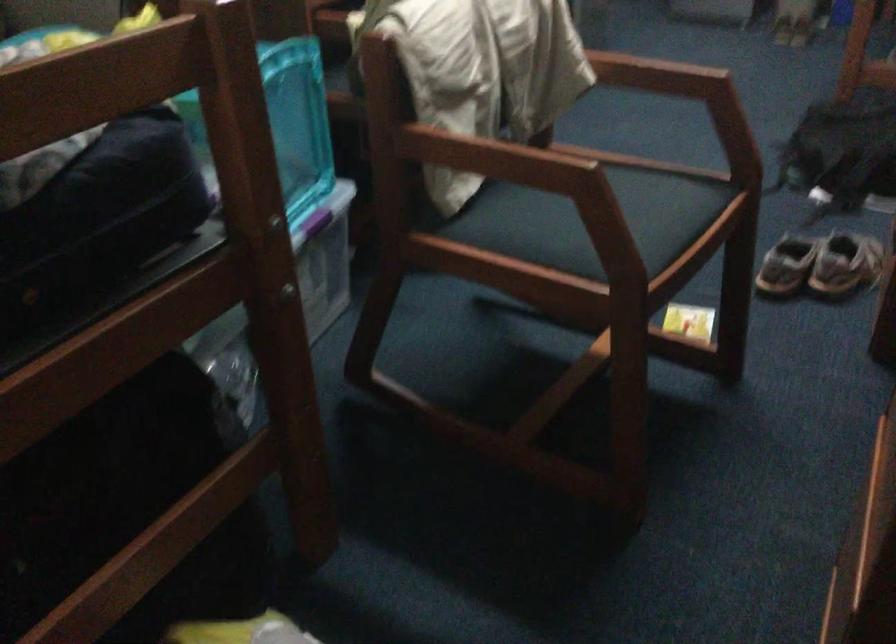
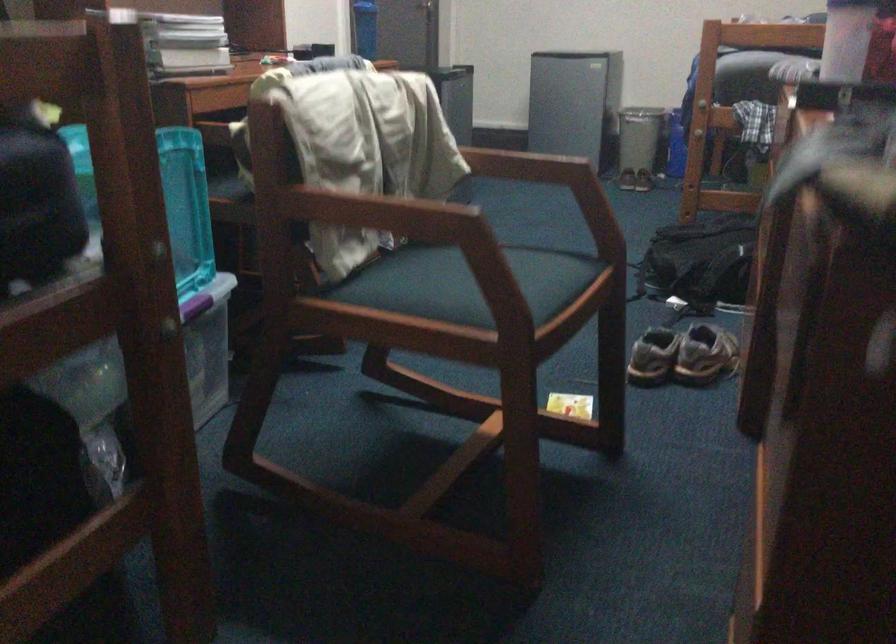
What movement of the cameraman would produce the second image?

The movement direction of the cameraman is left, forward.